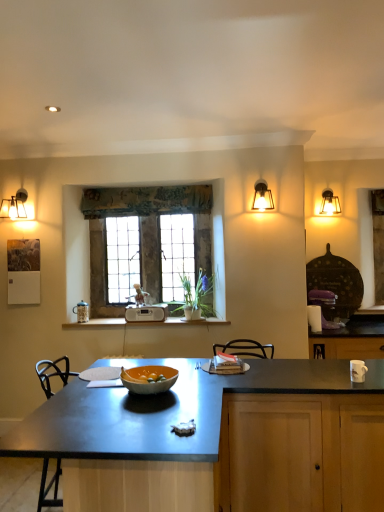
Locate an element on the screen. orange matte glass bowl at center is located at coordinates (149, 381).

Find the location of a particular element. The image size is (384, 512). stained glass window at center is located at coordinates (144, 234).

What do you see at coordinates (185, 322) in the screenshot?
I see `white wood window sill at center` at bounding box center [185, 322].

Locate an element on the screen. metallic gray countertop at center is located at coordinates (172, 412).

The image size is (384, 512). Identify the location of white plastic radio at center. (146, 313).

Is white plastic radio at center surrounding stained glass window at center?

No, stained glass window at center is not surrounded by white plastic radio at center.

Which is behind, point (138, 311) or point (155, 294)?

Positioned behind is point (155, 294).

Are white plastic radio at center and stained glass window at center located far from each other?

That's not correct — white plastic radio at center is a little close to stained glass window at center.

Would you say white plastic radio at center is to the left or to the right of stained glass window at center in the picture?

In the image, white plastic radio at center appears on the left side of stained glass window at center.

Is matte glass sconce at upper right taller than white plastic radio at center?

Correct, matte glass sconce at upper right is much taller as white plastic radio at center.

Is matte glass sconce at upper right completely or partially outside of white plastic radio at center?

Yes, matte glass sconce at upper right is not within white plastic radio at center.

Based on the photo, considering the relative positions of matte glass sconce at upper right and white plastic radio at center in the image provided, is matte glass sconce at upper right behind white plastic radio at center?

No, matte glass sconce at upper right is closer to the viewer.

Is matte glass sconce at upper right far away from white plastic radio at center?

Absolutely, matte glass sconce at upper right is distant from white plastic radio at center.

Considering the relative positions of stained glass window at center and orange matte glass bowl at center in the image provided, is stained glass window at center to the left or to the right of orange matte glass bowl at center?

In the image, stained glass window at center appears on the left side of orange matte glass bowl at center.

Which point is more forward, (95,236) or (153,366)?

Point (153,366)

From a real-world perspective, is stained glass window at center physically below orange matte glass bowl at center?

No, from a real-world perspective, stained glass window at center is not under orange matte glass bowl at center.

Considering the relative sizes of stained glass window at center and orange matte glass bowl at center in the image provided, is stained glass window at center smaller than orange matte glass bowl at center?

Incorrect, stained glass window at center is not smaller in size than orange matte glass bowl at center.

Find the location of a particular element. light fixture behind the orange matte glass bowl at center is located at coordinates (262, 197).

Does orange matte glass bowl at center have a larger size compared to matte glass sconce at upper right?

Actually, orange matte glass bowl at center might be smaller than matte glass sconce at upper right.

Is orange matte glass bowl at center not near matte glass sconce at upper right?

Absolutely, orange matte glass bowl at center is distant from matte glass sconce at upper right.

Does orange matte glass bowl at center appear on the left side of matte glass sconce at upper right?

Correct, you'll find orange matte glass bowl at center to the left of matte glass sconce at upper right.

Which object is positioned more to the right, metallic gray countertop at center or white wood window sill at center?

metallic gray countertop at center is more to the right.

Based on the photo, which is closer to the camera, (43,426) or (112,319)?

The point (43,426) is closer.

From a real-world perspective, is metallic gray countertop at center below white wood window sill at center?

Yes.

Is orange matte glass bowl at center aimed at white plastic radio at center?

No, orange matte glass bowl at center is not aimed at white plastic radio at center.

Measure the distance between orange matte glass bowl at center and white plastic radio at center.

orange matte glass bowl at center and white plastic radio at center are 1.48 meters apart from each other.

Where is `glass bowl that is in front of the white plastic radio at center`? The width and height of the screenshot is (384, 512). glass bowl that is in front of the white plastic radio at center is located at coordinates (149, 381).

Based on the photo, is orange matte glass bowl at center positioned far away from white plastic radio at center?

Absolutely, orange matte glass bowl at center is distant from white plastic radio at center.

Considering the positions of point (194, 232) and point (261, 208), is point (194, 232) closer or farther from the camera than point (261, 208)?

Clearly, point (194, 232) is more distant from the camera than point (261, 208).

Does stained glass window at center have a smaller size compared to matte glass sconce at upper right?

Actually, stained glass window at center might be larger than matte glass sconce at upper right.

Considering the relative sizes of stained glass window at center and matte glass sconce at upper right in the image provided, is stained glass window at center shorter than matte glass sconce at upper right?

Incorrect, the height of stained glass window at center does not fall short of that of matte glass sconce at upper right.

The width and height of the screenshot is (384, 512). I want to click on window beneath the matte glass sconce at upper right (from a real-world perspective), so click(x=144, y=234).

Find the location of a particular element. The width and height of the screenshot is (384, 512). window on the right of white plastic radio at center is located at coordinates (144, 234).

The width and height of the screenshot is (384, 512). Find the location of `light fixture above the white plastic radio at center (from the image's perspective)`. light fixture above the white plastic radio at center (from the image's perspective) is located at coordinates (262, 197).

Based on their spatial positions, is matte glass sconce at upper right or orange matte glass bowl at center further from stained glass window at center?

orange matte glass bowl at center is positioned further to the anchor stained glass window at center.

Estimate the real-world distances between objects in this image. Which object is further from white wood window sill at center, metallic glass lampshade at upper right or white plastic radio at center?

Based on the image, metallic glass lampshade at upper right appears to be further to white wood window sill at center.

From the image, which object appears to be farther from metallic gray countertop at center, metallic glass lampshade at upper right or white wood window sill at center?

metallic glass lampshade at upper right.

Which object lies further to the anchor point white plastic radio at center, white wood window sill at center or orange matte glass bowl at center?

orange matte glass bowl at center is positioned further to the anchor white plastic radio at center.

When comparing their distances from textured fabric curtain at upper center, does white wood window sill at center or stained glass window at center seem further?

white wood window sill at center is positioned further to the anchor textured fabric curtain at upper center.

Looking at the image, which one is located closer to matte glass sconce at upper right, metallic glass lampshade at upper right or stained glass window at center?

metallic glass lampshade at upper right is positioned closer to the anchor matte glass sconce at upper right.

From the image, which object appears to be farther from stained glass window at center, metallic glass lampshade at upper right or metallic gray countertop at center?

Based on the image, metallic gray countertop at center appears to be further to stained glass window at center.

Based on their spatial positions, is orange matte glass bowl at center or metallic glass lampshade at upper right closer to textured fabric curtain at upper center?

metallic glass lampshade at upper right is closer to textured fabric curtain at upper center.

Identify the location of curtain between orange matte glass bowl at center and stained glass window at center along the z-axis. (146, 200).

At what (x,y) coordinates should I click in order to perform the action: click on appliance between metallic gray countertop at center and stained glass window at center from front to back. Please return your answer as a coordinate pair (x, y). The image size is (384, 512). Looking at the image, I should click on (146, 313).

This screenshot has height=512, width=384. Identify the location of window sill situated between stained glass window at center and metallic glass lampshade at upper right from left to right. (185, 322).

This screenshot has height=512, width=384. Identify the location of window between textured fabric curtain at upper center and metallic glass lampshade at upper right in the horizontal direction. (144, 234).